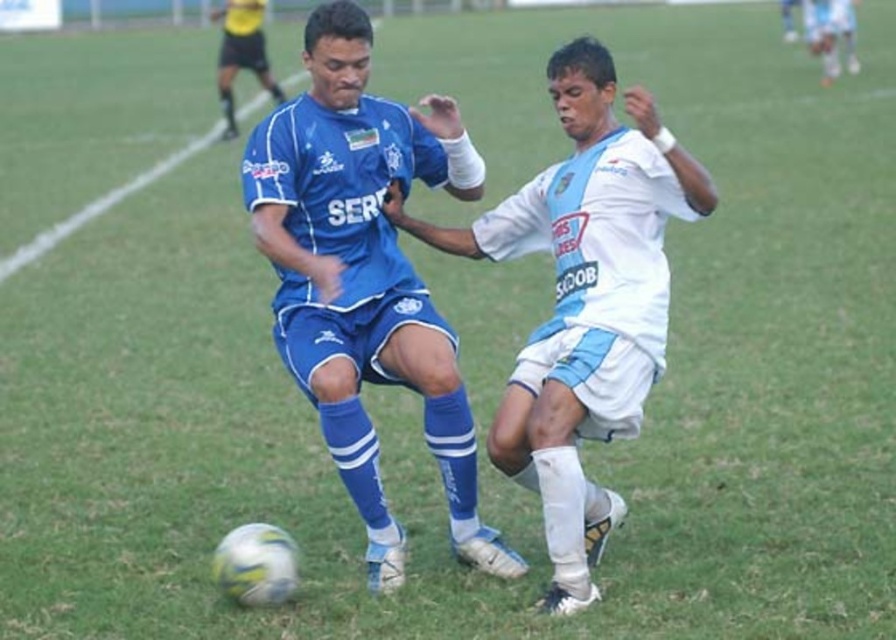
You are a referee watching this soccer match. You notice the matte blue jersey at center and the white matte soccer player at center. Which one is higher in the image?

The matte blue jersey at center is above the white matte soccer player at center, so the matte blue jersey at center is higher in the image.

You are a soccer referee observing the match. The ball is at position coordinates 0.45, 0.45. Which player is closer to the ball, the matte blue jersey at center or the white uniform with light blue accents?

The matte blue jersey at center is located at point (365, 276), which is closer to the ball at (402, 288) than the white uniform with light blue accents. Therefore, the matte blue jersey at center is closer to the ball.

Looking at this image, you are a soccer referee standing at the center of the field. You need to determine if the ball is within the penalty area, which is marked by a rectangle extending from the goal line to 18 yards out. The ball is at point (365, 276). Is the ball inside the penalty area?

The point (365, 276) marks the matte blue jersey at center, so the ball is not inside the penalty area since it is located at the center where the jersey is, not near the goal area.